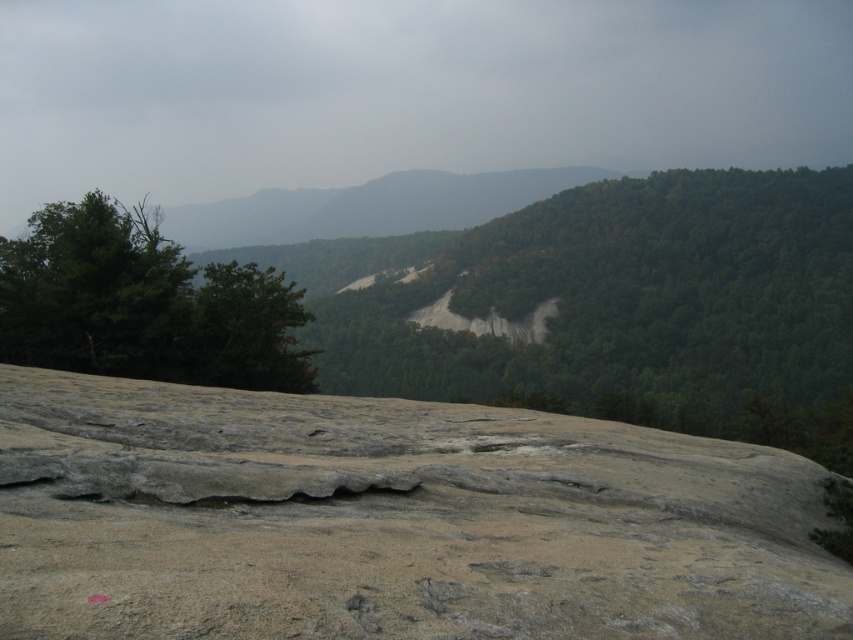
Can you confirm if green leafy tree at center is thinner than green leafy tree at left?

In fact, green leafy tree at center might be wider than green leafy tree at left.

Find the location of a particular element. Image resolution: width=853 pixels, height=640 pixels. green leafy tree at center is located at coordinates (631, 310).

Find the location of a particular element. The height and width of the screenshot is (640, 853). green leafy tree at center is located at coordinates (631, 310).